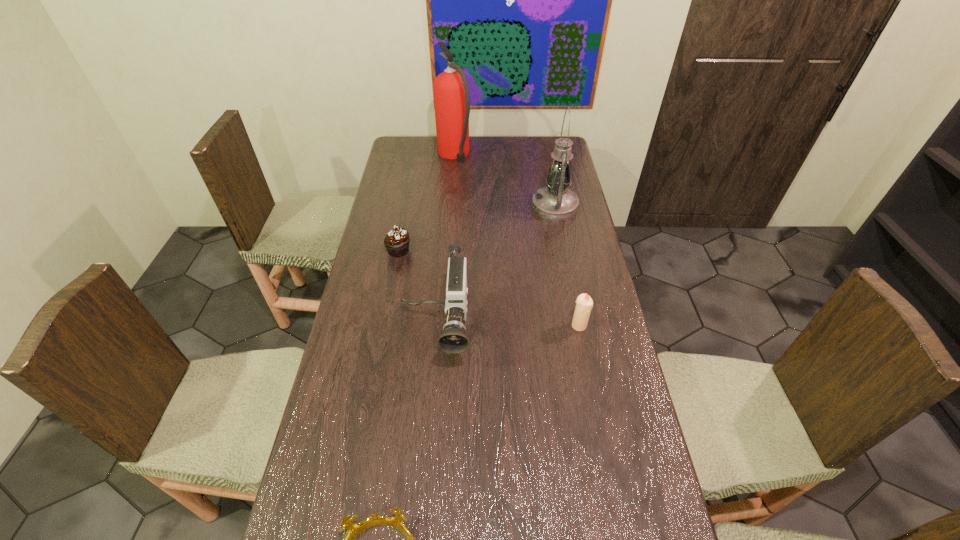
The width and height of the screenshot is (960, 540). I want to click on object present at the far edge, so click(x=451, y=92).

The width and height of the screenshot is (960, 540). I want to click on object present at the left edge, so click(x=396, y=241).

Identify the location of oil lamp located in the right edge section of the desktop. (556, 202).

The image size is (960, 540). I want to click on candle at the right edge, so click(x=584, y=303).

Where is `vacant position at the far edge of the desktop`? vacant position at the far edge of the desktop is located at coordinates pyautogui.click(x=530, y=147).

Locate an element on the screen. This screenshot has height=540, width=960. free region at the left edge of the desktop is located at coordinates (411, 201).

Locate an element on the screen. This screenshot has width=960, height=540. free space at the right edge of the desktop is located at coordinates (578, 234).

At what (x,y) coordinates should I click in order to perform the action: click on free space at the far left corner. Please return your answer as a coordinate pair (x, y). This screenshot has height=540, width=960. Looking at the image, I should click on (397, 140).

Find the location of a particular element. This screenshot has height=540, width=960. vacant region between the fourth nearest object and the camcorder is located at coordinates (417, 293).

Where is `free space between the oil lamp and the fourth nearest object`? This screenshot has height=540, width=960. free space between the oil lamp and the fourth nearest object is located at coordinates (476, 228).